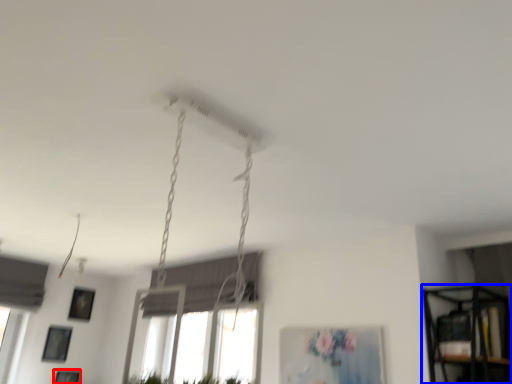
Question: Which object appears farthest to the camera in this image, picture frame (highlighted by a red box) or shelf (highlighted by a blue box)?

Choices:
 (A) picture frame
 (B) shelf

Answer: (A)